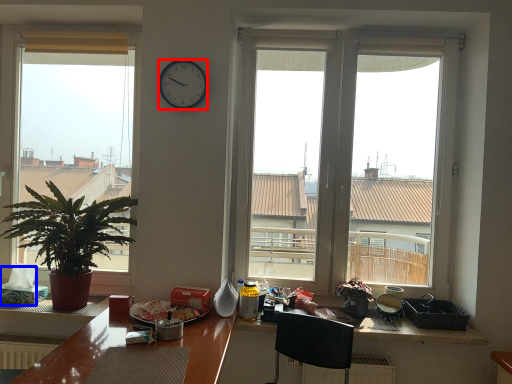
Question: Which point is further to the camera, clock (highlighted by a red box) or tissue paper (highlighted by a blue box)?

Choices:
 (A) clock
 (B) tissue paper

Answer: (B)